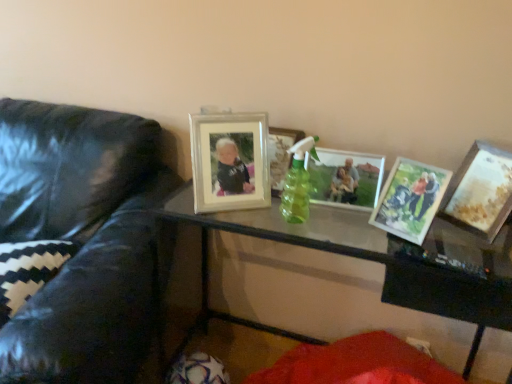
Question: Could transparent glass table at center be considered to be inside matte silver picture frame at center, the 2th picture frame when ordered from left to right?

Choices:
 (A) yes
 (B) no

Answer: (B)

Question: Considering the relative sizes of matte silver picture frame at center, marked as the 4th picture frame in a right-to-left arrangement, and transparent glass table at center in the image provided, is matte silver picture frame at center, marked as the 4th picture frame in a right-to-left arrangement, bigger than transparent glass table at center?

Choices:
 (A) no
 (B) yes

Answer: (A)

Question: Can you confirm if matte silver picture frame at center, the 2th picture frame when ordered from left to right, is smaller than transparent glass table at center?

Choices:
 (A) no
 (B) yes

Answer: (B)

Question: From the image's perspective, does matte silver picture frame at center, the 2th picture frame when ordered from left to right, appear lower than transparent glass table at center?

Choices:
 (A) no
 (B) yes

Answer: (A)

Question: From a real-world perspective, does matte silver picture frame at center, the 2th picture frame when ordered from left to right, sit lower than transparent glass table at center?

Choices:
 (A) yes
 (B) no

Answer: (B)

Question: From the image's perspective, is matte wooden picture frame at center right, which appears as the 2th picture frame when viewed from the right, located above or below white glossy picture frame at upper center, marked as the 5th picture frame in a right-to-left arrangement?

Choices:
 (A) below
 (B) above

Answer: (A)

Question: Would you say matte wooden picture frame at center right, the fourth picture frame from the left, is to the left or to the right of white glossy picture frame at upper center, marked as the 5th picture frame in a right-to-left arrangement, in the picture?

Choices:
 (A) right
 (B) left

Answer: (A)

Question: Considering the positions of point (418, 187) and point (256, 192), is point (418, 187) closer or farther from the camera than point (256, 192)?

Choices:
 (A) closer
 (B) farther

Answer: (A)

Question: Is matte wooden picture frame at center right, which appears as the 2th picture frame when viewed from the right, spatially inside white glossy picture frame at upper center, which is the first picture frame from left to right, or outside of it?

Choices:
 (A) outside
 (B) inside

Answer: (A)

Question: Considering their positions, is black zigzag-patterned pillow at left located in front of or behind transparent glass table at center?

Choices:
 (A) behind
 (B) front

Answer: (A)

Question: From the image's perspective, is black zigzag-patterned pillow at left located above or below transparent glass table at center?

Choices:
 (A) below
 (B) above

Answer: (B)

Question: Is black zigzag-patterned pillow at left spatially inside transparent glass table at center, or outside of it?

Choices:
 (A) outside
 (B) inside

Answer: (A)

Question: From a real-world perspective, is black zigzag-patterned pillow at left physically located above or below transparent glass table at center?

Choices:
 (A) below
 (B) above

Answer: (B)

Question: From the image's perspective, is matte silver picture frame at center, marked as the 4th picture frame in a right-to-left arrangement, positioned above or below black zigzag-patterned pillow at left?

Choices:
 (A) above
 (B) below

Answer: (A)

Question: From a real-world perspective, is matte silver picture frame at center, marked as the 4th picture frame in a right-to-left arrangement, above or below black zigzag-patterned pillow at left?

Choices:
 (A) above
 (B) below

Answer: (A)